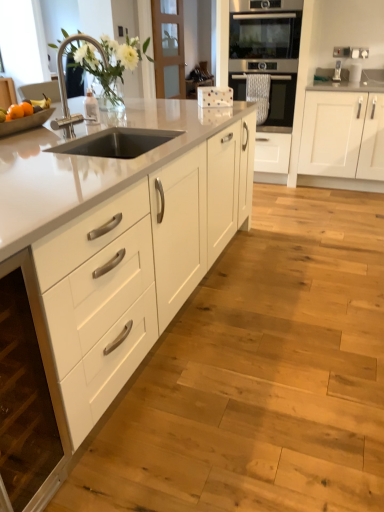
Question: From a real-world perspective, is stainless steel oven at center, the 2th oven viewed from the top, above or below white matte cabinet at lower left, which appears as the second cabinetry when viewed from the left?

Choices:
 (A) below
 (B) above

Answer: (B)

Question: Considering the positions of stainless steel oven at center, which is the 1th oven in bottom-to-top order, and white matte cabinet at lower left, which appears as the second cabinetry when viewed from the left, in the image, is stainless steel oven at center, which is the 1th oven in bottom-to-top order, bigger or smaller than white matte cabinet at lower left, which appears as the second cabinetry when viewed from the left,?

Choices:
 (A) big
 (B) small

Answer: (A)

Question: Which of these objects is positioned closest to the orange matte at left, acting as the second orange starting from the back?

Choices:
 (A) white matte cabinet at lower left, which appears as the second cabinetry when viewed from the left
 (B) orange matte fruit at left, marked as the 1th orange in a back-to-front arrangement
 (C) white glossy cabinets at center, arranged as the third cabinetry when viewed from the right
 (D) stainless steel oven at center, the 2th oven viewed from the top
 (E) stainless steel oven at center, which appears as the 1th oven when viewed from the top

Answer: (B)

Question: Which is nearer to the white matte cabinet at lower left, placed as the second cabinetry when sorted from right to left?

Choices:
 (A) white glossy cabinets at center, arranged as the third cabinetry when viewed from the right
 (B) orange matte at left, the first orange in the front-to-back sequence
 (C) silver metallic faucet at upper left
 (D) orange matte fruit at left, the second orange in the front-to-back sequence
 (E) white matte cabinet at right, which is the first cabinetry from right to left

Answer: (A)